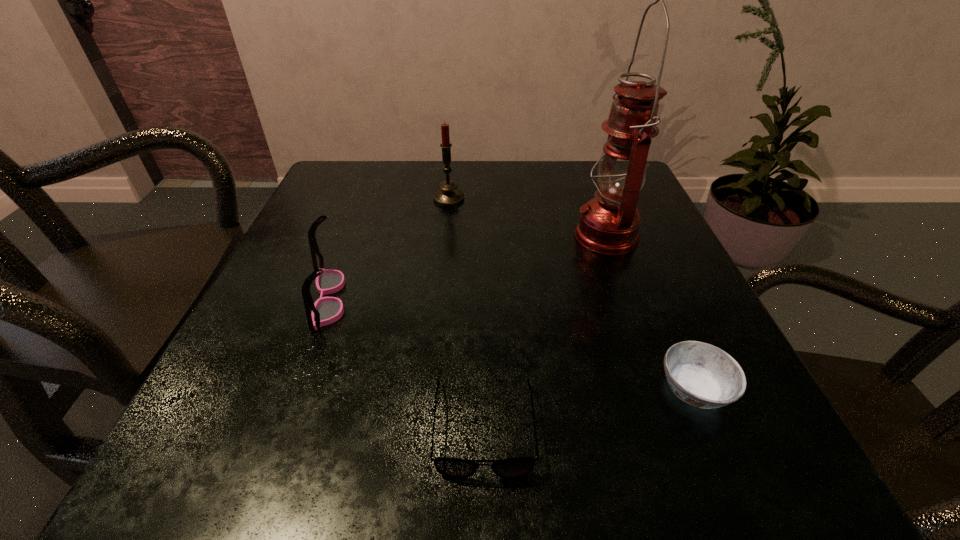
This screenshot has height=540, width=960. Identify the location of vacant space that is in between the ashtray and the oil lamp. (650, 313).

This screenshot has width=960, height=540. I want to click on vacant area between the ashtray and the tallest object, so click(650, 313).

Find the location of a particular element. free area in between the candle and the second farthest object is located at coordinates (527, 217).

Where is `free space between the oil lamp and the candle`? free space between the oil lamp and the candle is located at coordinates point(527,217).

Identify the location of empty space that is in between the second tallest object and the left spectacles. This screenshot has width=960, height=540. (388, 248).

Find the location of a particular element. Image resolution: width=960 pixels, height=540 pixels. empty location between the farthest object and the ashtray is located at coordinates (571, 294).

Identify the location of free space between the ashtray and the leftmost object. (511, 344).

Locate an element on the screen. vacant space that is in between the tallest object and the farthest object is located at coordinates (527, 217).

This screenshot has width=960, height=540. Identify the location of unoccupied area between the nearer spectacles and the candle. (467, 313).

Find the location of a particular element. This screenshot has width=960, height=540. object that is the third nearest to the nearer spectacles is located at coordinates (609, 223).